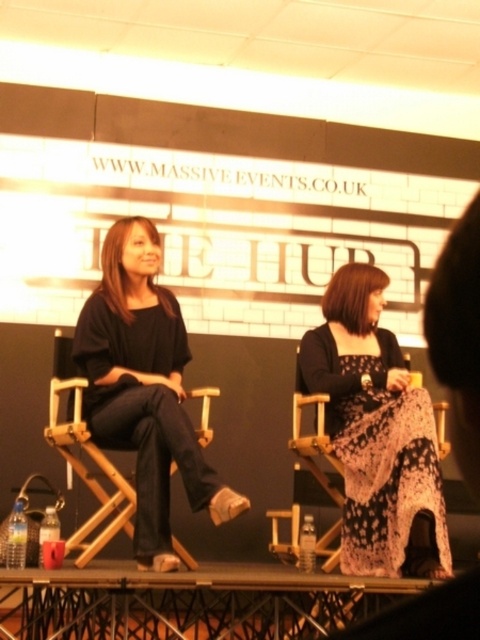
Question: Is black lace dress at center behind matte black top at center?

Choices:
 (A) yes
 (B) no

Answer: (B)

Question: Is black lace dress at center wider than matte black top at center?

Choices:
 (A) yes
 (B) no

Answer: (B)

Question: Is black lace dress at center in front of matte black top at center?

Choices:
 (A) yes
 (B) no

Answer: (A)